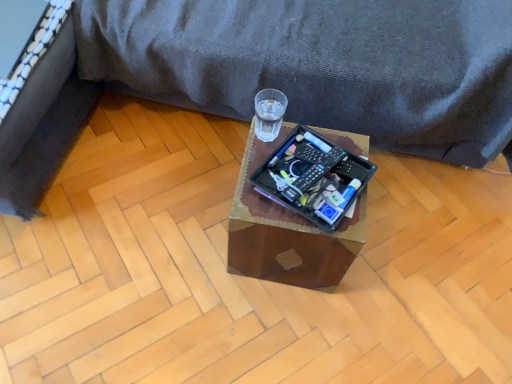
At what (x,y) coordinates should I click in order to perform the action: click on free location to the right of wooden tray at center. Please return your answer as a coordinate pair (x, y). Image resolution: width=512 pixels, height=384 pixels. Looking at the image, I should click on (388, 263).